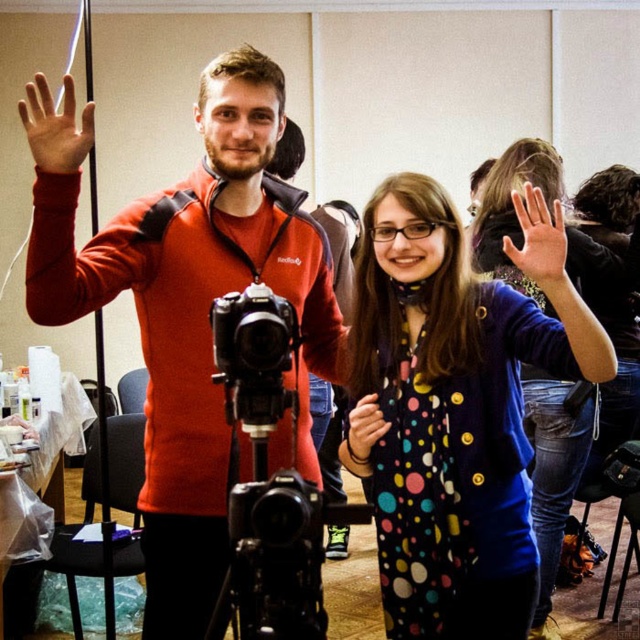
You are standing at point (584, 349) in the scene. You want to take a photo of the camera mounted on the tripod. Is the camera within your reach if you can extend your arm 4 feet?

The distance between point (584, 349) and the camera is 4.75 feet. Since your arm can only extend 4 feet, you cannot reach the camera.

You are a photographer setting up equipment in the scene. You need to place a small decorative item on top of the black plastic tripod at center. Can you do this without it being blocked by the polka dot fabric dress at center?

The polka dot fabric dress at center is taller than the black plastic tripod at center. Since the dress is taller, placing the item on the tripod might be blocked by the dress.

You are trying to decide which item to place in a narrow closet. Based on the image, which object between the matte red jacket at center and the polka dot fabric dress at center takes up more space?

The matte red jacket at center might be wider than the polka dot fabric dress at center, so it would take up more space in the narrow closet.